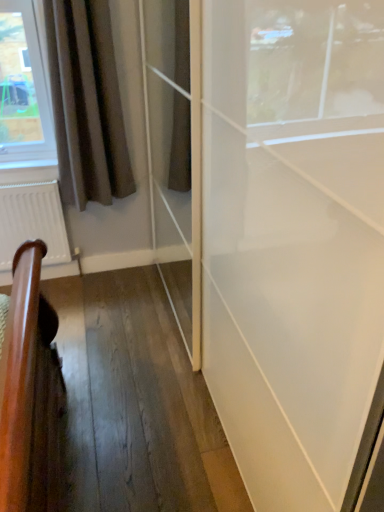
Find the location of a particular element. brown fabric curtain at left is located at coordinates (86, 103).

Measure the distance between point (60, 156) and camera.

A distance of 2.30 meters exists between point (60, 156) and camera.

Describe the element at coordinates (86, 103) in the screenshot. The height and width of the screenshot is (512, 384). I see `brown fabric curtain at left` at that location.

Describe the element at coordinates (32, 222) in the screenshot. I see `white matte radiator at lower left` at that location.

In order to click on white matte radiator at lower left in this screenshot , I will do `click(32, 222)`.

In order to click on brown fabric curtain at left in this screenshot , I will do `click(86, 103)`.

Is white matte radiator at lower left at the right side of brown fabric curtain at left?

No, white matte radiator at lower left is not to the right of brown fabric curtain at left.

Considering the relative positions of white matte radiator at lower left and brown fabric curtain at left in the image provided, is white matte radiator at lower left in front of brown fabric curtain at left?

No, white matte radiator at lower left is further to the viewer.

Which is in front, point (30, 195) or point (106, 173)?

Positioned in front is point (30, 195).

From the image's perspective, is white matte radiator at lower left under brown fabric curtain at left?

Correct, white matte radiator at lower left appears lower than brown fabric curtain at left in the image.

From a real-world perspective, is white matte radiator at lower left located higher than brown fabric curtain at left?

No.

In terms of width, does white matte radiator at lower left look wider or thinner when compared to brown fabric curtain at left?

In the image, white matte radiator at lower left appears to be more narrow than brown fabric curtain at left.

From their relative heights in the image, would you say white matte radiator at lower left is taller or shorter than brown fabric curtain at left?

white matte radiator at lower left is shorter than brown fabric curtain at left.

Considering the sizes of objects white matte radiator at lower left and brown fabric curtain at left in the image provided, who is smaller, white matte radiator at lower left or brown fabric curtain at left?

white matte radiator at lower left is smaller.

Would you say brown fabric curtain at left is part of white matte radiator at lower left's contents?

Actually, brown fabric curtain at left is outside white matte radiator at lower left.

Are white matte radiator at lower left and brown fabric curtain at left located far from each other?

That's not correct — white matte radiator at lower left is a little close to brown fabric curtain at left.

Could you tell me if white matte radiator at lower left is turned towards brown fabric curtain at left?

No, white matte radiator at lower left is not oriented towards brown fabric curtain at left.

What's the angular difference between white matte radiator at lower left and brown fabric curtain at left's facing directions?

The facing directions of white matte radiator at lower left and brown fabric curtain at left are 0.0677 degrees apart.

Identify the location of curtain located above the white matte radiator at lower left (from the image's perspective). The image size is (384, 512). (86, 103).

Does brown fabric curtain at left appear on the right side of white matte radiator at lower left?

Correct, you'll find brown fabric curtain at left to the right of white matte radiator at lower left.

Which is in front, brown fabric curtain at left or white matte radiator at lower left?

Positioned in front is brown fabric curtain at left.

Is point (80, 208) positioned behind point (21, 187)?

Yes, point (80, 208) is behind point (21, 187).

From the image's perspective, would you say brown fabric curtain at left is positioned over white matte radiator at lower left?

Yes.

From a real-world perspective, who is located higher, brown fabric curtain at left or white matte radiator at lower left?

brown fabric curtain at left.

Considering the sizes of objects brown fabric curtain at left and white matte radiator at lower left in the image provided, who is wider, brown fabric curtain at left or white matte radiator at lower left?

Wider between the two is brown fabric curtain at left.

In the scene shown: Considering the relative sizes of brown fabric curtain at left and white matte radiator at lower left in the image provided, is brown fabric curtain at left shorter than white matte radiator at lower left?

Incorrect, the height of brown fabric curtain at left does not fall short of that of white matte radiator at lower left.

Is brown fabric curtain at left smaller than white matte radiator at lower left?

No, brown fabric curtain at left is not smaller than white matte radiator at lower left.

Is brown fabric curtain at left situated inside white matte radiator at lower left or outside?

brown fabric curtain at left cannot be found inside white matte radiator at lower left.

Is brown fabric curtain at left touching white matte radiator at lower left?

No.

Is brown fabric curtain at left looking in the opposite direction of white matte radiator at lower left?

That's not correct — brown fabric curtain at left is not looking away from white matte radiator at lower left.

How much distance is there between brown fabric curtain at left and white matte radiator at lower left?

brown fabric curtain at left and white matte radiator at lower left are 36.61 centimeters apart from each other.

You are a GUI agent. You are given a task and a screenshot of the screen. Output one action in this format:
    pyautogui.click(x=<x>, y=<y>)
    Task: Click on the radiator below the brown fabric curtain at left (from a real-world perspective)
    This screenshot has height=512, width=384.
    Given the screenshot: What is the action you would take?
    pyautogui.click(x=32, y=222)

In order to click on curtain that is on the right side of white matte radiator at lower left in this screenshot , I will do `click(86, 103)`.

This screenshot has width=384, height=512. Identify the location of curtain above the white matte radiator at lower left (from the image's perspective). (86, 103).